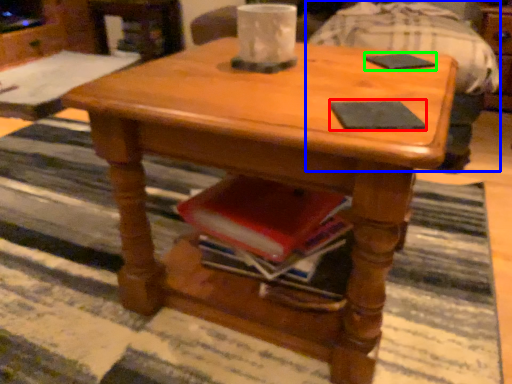
Question: Considering the real-world distances, which object is closest to pad (highlighted by a red box)? swivel chair (highlighted by a blue box) or pad (highlighted by a green box).

Choices:
 (A) swivel chair
 (B) pad

Answer: (B)